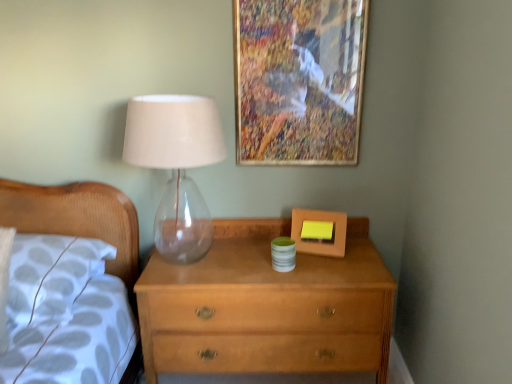
Locate an element on the screen. This screenshot has width=512, height=384. vacant region to the right of matte wooden picture frame at center, which is counted as the first picture frame, starting from the bottom is located at coordinates (362, 251).